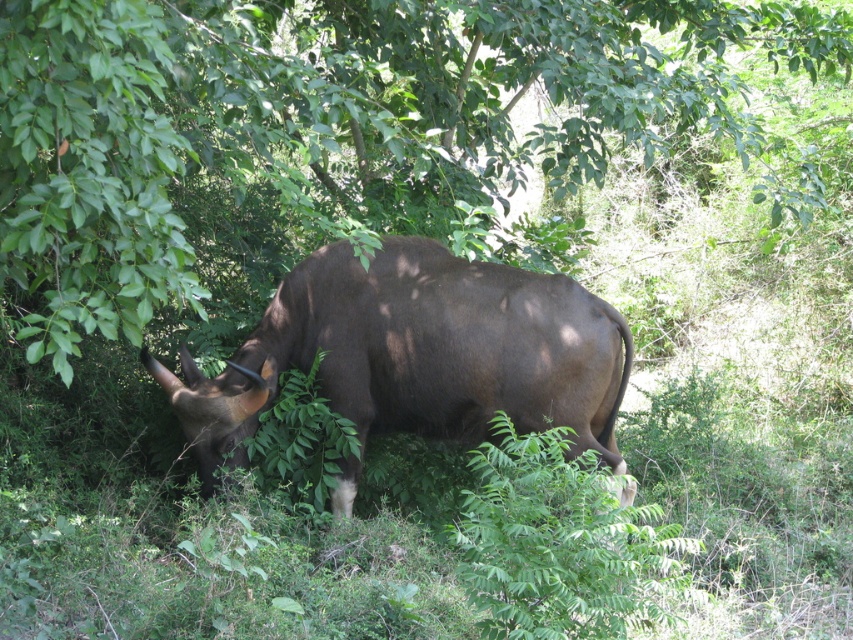
Question: Which point is farther to the camera?

Choices:
 (A) brown matte bull at center
 (B) green leafy tree at center

Answer: (A)

Question: Does green leafy tree at center come behind brown matte bull at center?

Choices:
 (A) no
 (B) yes

Answer: (A)

Question: Observing the image, what is the correct spatial positioning of green leafy tree at center in reference to brown matte bull at center?

Choices:
 (A) above
 (B) below

Answer: (A)

Question: Which point is closer to the camera?

Choices:
 (A) tap(350, 397)
 (B) tap(119, 124)

Answer: (B)

Question: From the image, what is the correct spatial relationship of green leafy tree at center in relation to brown matte bull at center?

Choices:
 (A) right
 (B) left

Answer: (B)

Question: Which point appears closest to the camera in this image?

Choices:
 (A) (115, 161)
 (B) (424, 388)

Answer: (A)